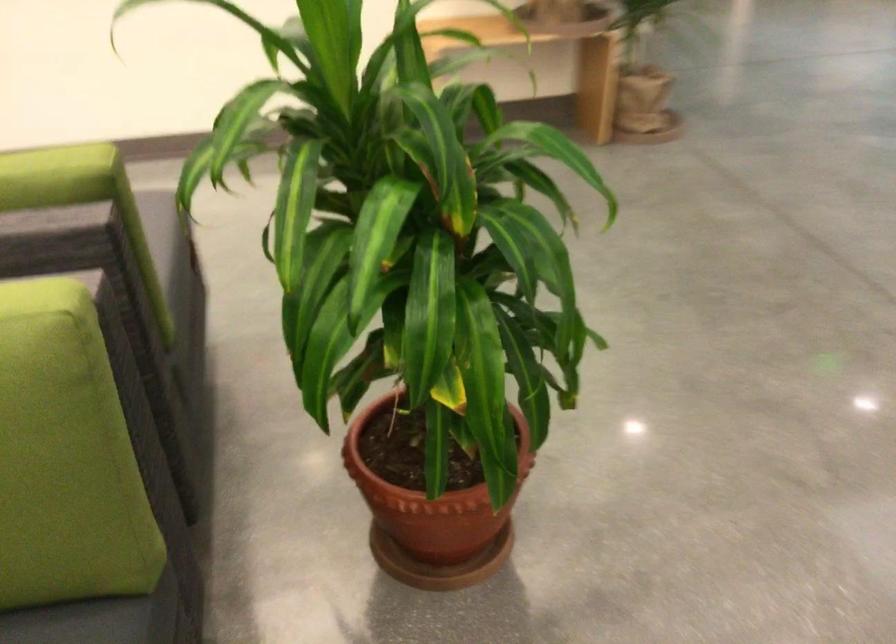
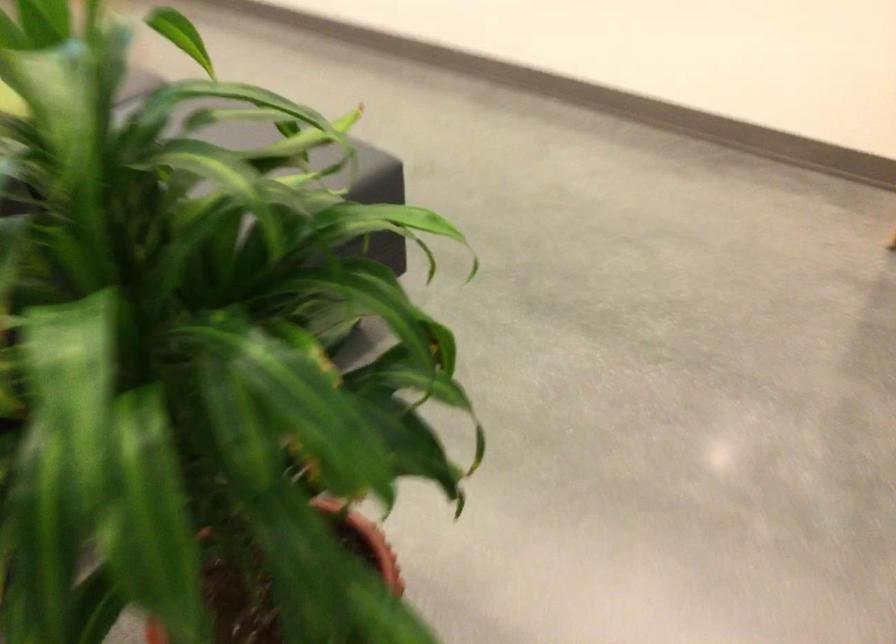
Where in the second image is the point corresponding to point (165, 216) from the first image?

(367, 167)